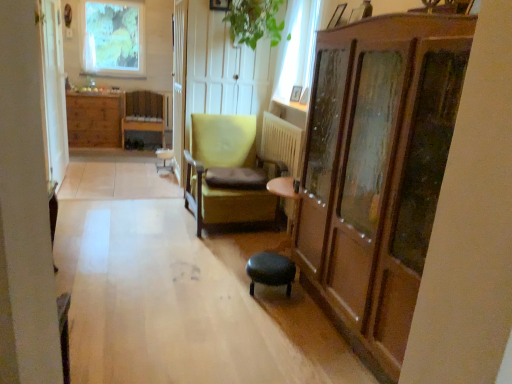
Find the location of a particular element. This screenshot has width=512, height=384. vacant space in front of white wooden screen door at center, acting as the second screen door starting from the left is located at coordinates (162, 188).